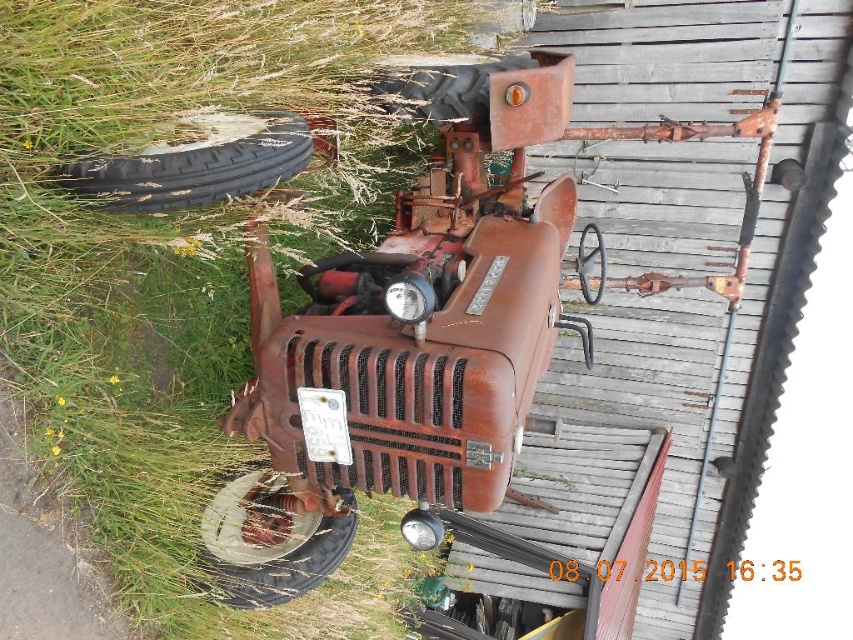
Consider the image. Is green grass at upper left thinner than rusty metal tire at lower left?

Incorrect, green grass at upper left's width is not less than rusty metal tire at lower left's.

Is point (134, 400) behind point (320, 518)?

No, (134, 400) is closer to viewer.

Is point (131, 509) positioned in front of point (276, 572)?

Yes, it is.

The height and width of the screenshot is (640, 853). What are the coordinates of `green grass at upper left` in the screenshot? It's located at (178, 259).

Can you confirm if green grass at upper left is positioned above black rubber tire at left?

No, green grass at upper left is not above black rubber tire at left.

Is green grass at upper left further to the viewer compared to black rubber tire at left?

No, green grass at upper left is in front of black rubber tire at left.

This screenshot has height=640, width=853. Identify the location of green grass at upper left. (178, 259).

Does green grass at upper left appear on the right side of rusty metal tire at center?

In fact, green grass at upper left is to the left of rusty metal tire at center.

Does green grass at upper left appear on the left side of rusty metal tire at center?

Yes, green grass at upper left is to the left of rusty metal tire at center.

Who is more distant from viewer, (137, 246) or (447, 113)?

Positioned behind is point (447, 113).

The height and width of the screenshot is (640, 853). In order to click on green grass at upper left in this screenshot , I will do `click(178, 259)`.